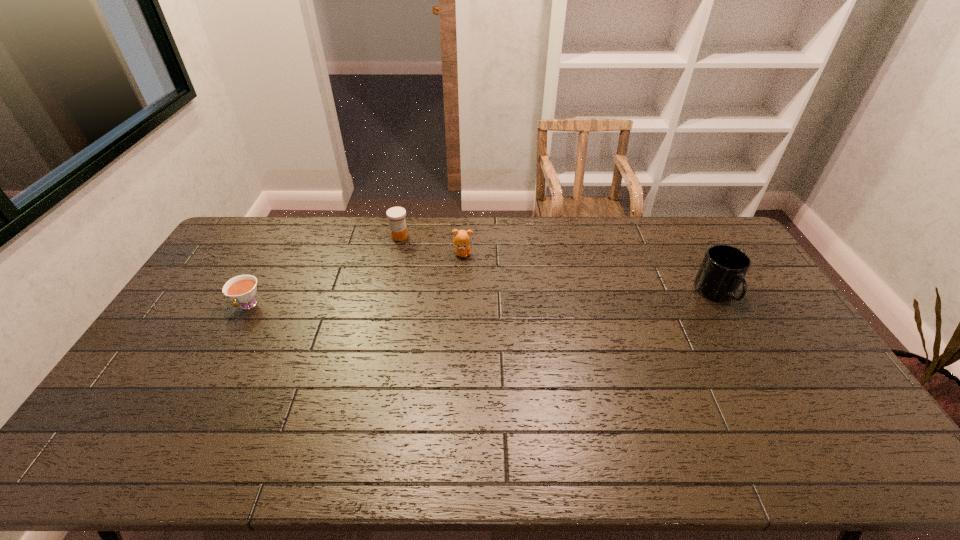
Locate an element on the screen. The width and height of the screenshot is (960, 540). vacant space situated on the label of the medicine is located at coordinates (422, 260).

Where is `vacant position located on the label of the medicine`? The image size is (960, 540). vacant position located on the label of the medicine is located at coordinates (413, 251).

Locate an element on the screen. This screenshot has height=540, width=960. vacant space located 0.150m on the label of the medicine is located at coordinates (424, 262).

Where is `vacant area located 0.400m on the face of the second farthest object`? The image size is (960, 540). vacant area located 0.400m on the face of the second farthest object is located at coordinates (566, 307).

You are a GUI agent. You are given a task and a screenshot of the screen. Output one action in this format:
    pyautogui.click(x=<x>, y=<y>)
    Task: Click on the vacant point located 0.110m on the face of the second farthest object
    The width and height of the screenshot is (960, 540).
    Given the screenshot: What is the action you would take?
    pyautogui.click(x=495, y=270)

At what (x,y) coordinates should I click in order to perform the action: click on free space located 0.160m on the face of the second farthest object. Please return your answer as a coordinate pair (x, y). The width and height of the screenshot is (960, 540). Looking at the image, I should click on (507, 276).

This screenshot has height=540, width=960. Identify the location of medicine located in the far edge section of the desktop. (396, 215).

The height and width of the screenshot is (540, 960). What are the coordinates of `teddy bear positioned at the far edge` in the screenshot? It's located at (461, 240).

You are a GUI agent. You are given a task and a screenshot of the screen. Output one action in this format:
    pyautogui.click(x=<x>, y=<y>)
    Task: Click on the object located at the left edge
    This screenshot has width=960, height=540.
    Given the screenshot: What is the action you would take?
    pyautogui.click(x=242, y=289)

Find the location of a particular element. This screenshot has width=960, height=540. object that is positioned at the right edge is located at coordinates (724, 267).